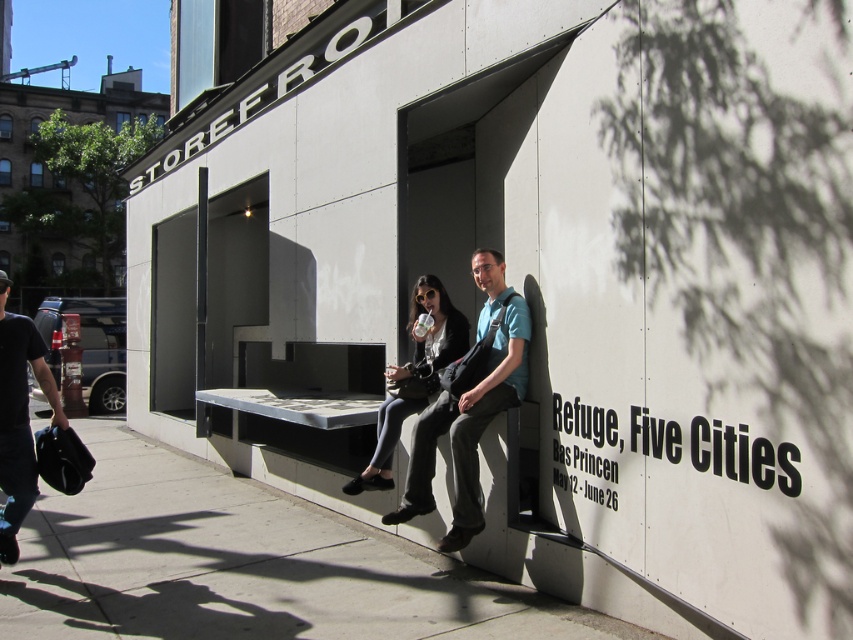
Consider the image. What is the relationship between the widths of the gray concrete bench at lower center and the matte black bench at center?

The gray concrete bench at lower center is wider than the matte black bench at center.

You are a delivery person who needs to place a small package on the tallest object between the gray concrete bench at lower center and the black leather bag at lower left. Which object should you choose?

The black leather bag at lower left is taller than the gray concrete bench at lower center, so you should place the package on the black leather bag at lower left.